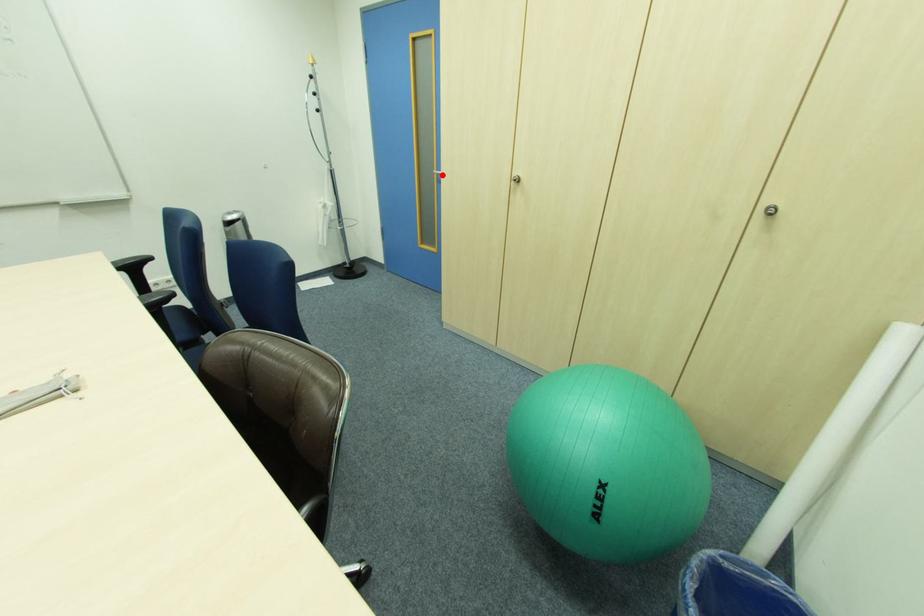
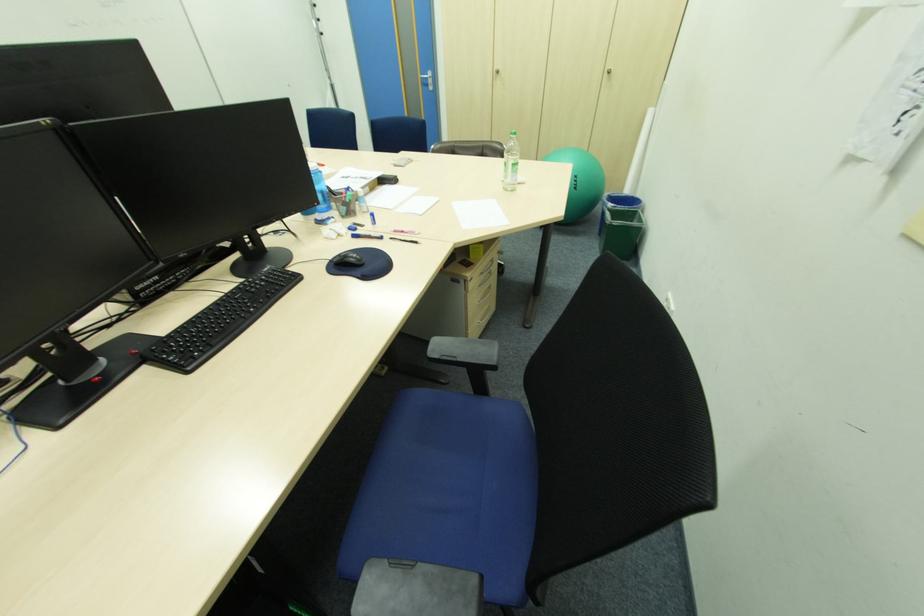
Locate, in the second image, the point that corresponds to the highlighted location in the first image.

(428, 79)